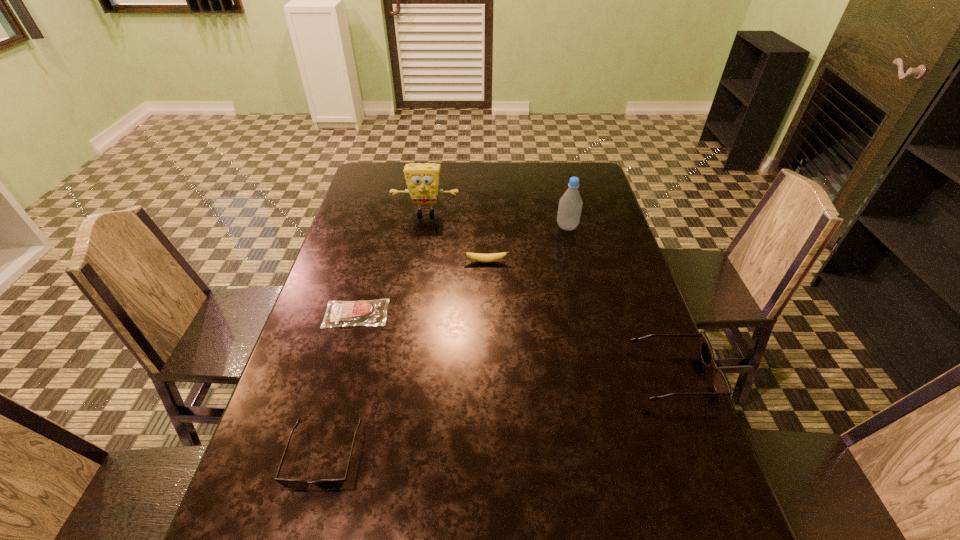
Image resolution: width=960 pixels, height=540 pixels. I want to click on steak, so click(x=362, y=312).

Where is `free space located 0.330m on the left of the bottle`? This screenshot has width=960, height=540. free space located 0.330m on the left of the bottle is located at coordinates (457, 227).

The image size is (960, 540). I want to click on vacant region located 0.080m on the face of the sponge, so click(x=422, y=234).

The width and height of the screenshot is (960, 540). Find the location of `vacant space located on the right of the fourth nearest object`. vacant space located on the right of the fourth nearest object is located at coordinates (616, 261).

At what (x,y) coordinates should I click in order to perform the action: click on free space located on the right of the fourth farthest object. Please return your answer as a coordinate pair (x, y). Image resolution: width=960 pixels, height=540 pixels. Looking at the image, I should click on (506, 314).

Where is `object that is at the near edge`? Image resolution: width=960 pixels, height=540 pixels. object that is at the near edge is located at coordinates (294, 484).

Locate an element on the screen. The width and height of the screenshot is (960, 540). sunglasses present at the left edge is located at coordinates (294, 484).

The width and height of the screenshot is (960, 540). I want to click on sponge positioned at the left edge, so click(422, 180).

This screenshot has height=540, width=960. What are the coordinates of `steak that is at the left edge` in the screenshot? It's located at (362, 312).

I want to click on sunglasses located in the right edge section of the desktop, so click(720, 383).